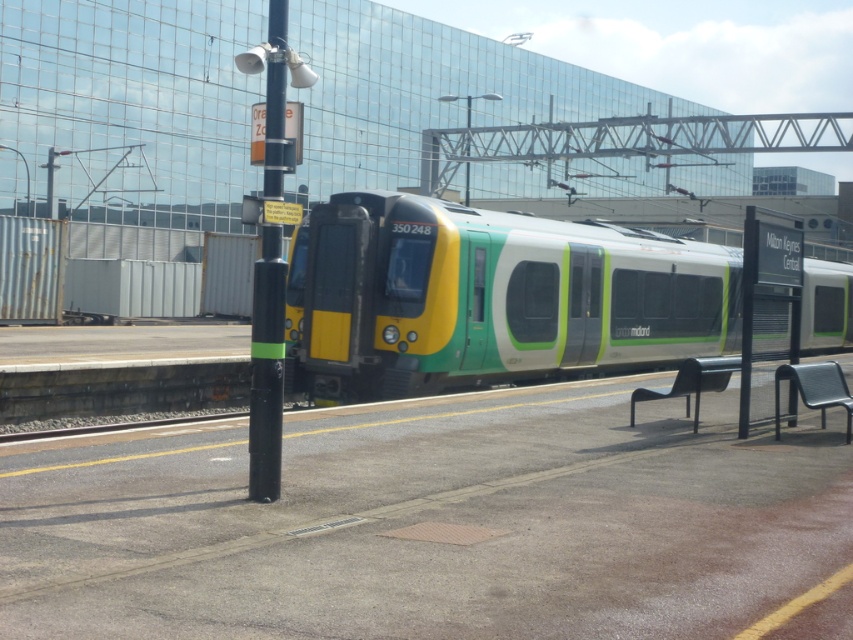
Question: Considering the relative positions of green matte train at center and black/green plastic pole at left in the image provided, where is green matte train at center located with respect to black/green plastic pole at left?

Choices:
 (A) below
 (B) above

Answer: (A)

Question: Which object appears closest to the camera in this image?

Choices:
 (A) green matte train at center
 (B) black/green plastic pole at left

Answer: (B)

Question: Does green matte train at center appear over black/green plastic pole at left?

Choices:
 (A) no
 (B) yes

Answer: (A)

Question: Can you confirm if green matte train at center is bigger than black/green plastic pole at left?

Choices:
 (A) yes
 (B) no

Answer: (A)

Question: Which of the following is the closest to the observer?

Choices:
 (A) black/green plastic pole at left
 (B) green matte train at center

Answer: (A)